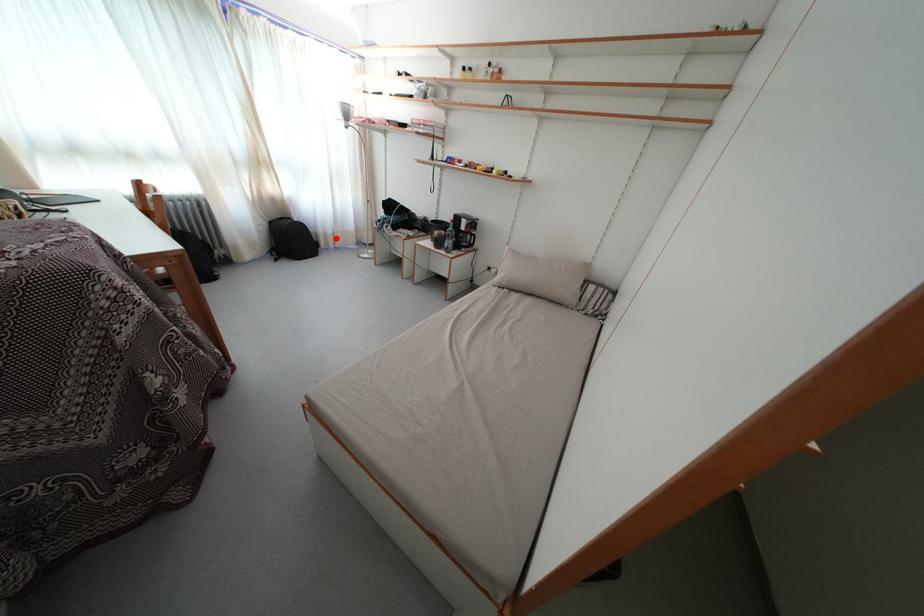
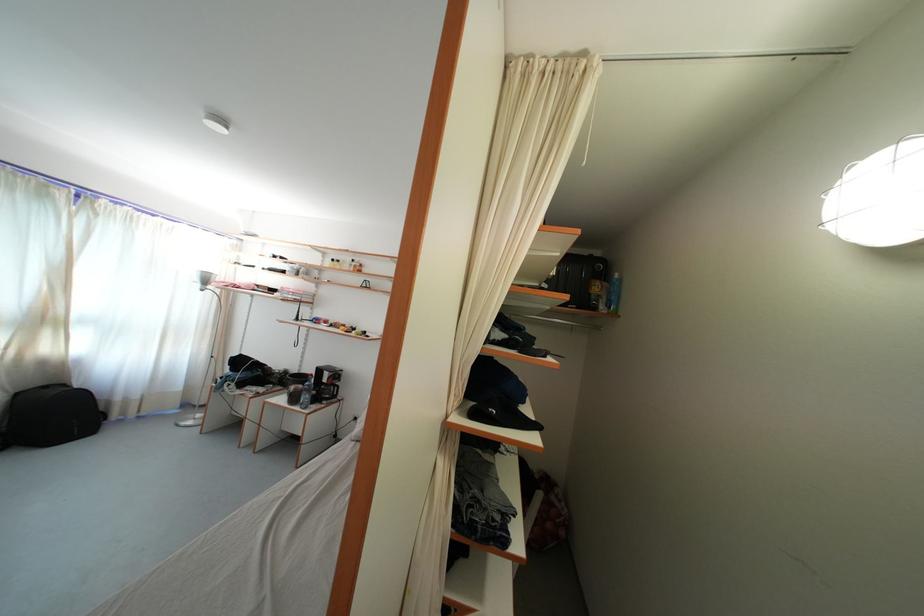
In the second image, find the point that corresponds to the highlighted location in the first image.

(141, 403)